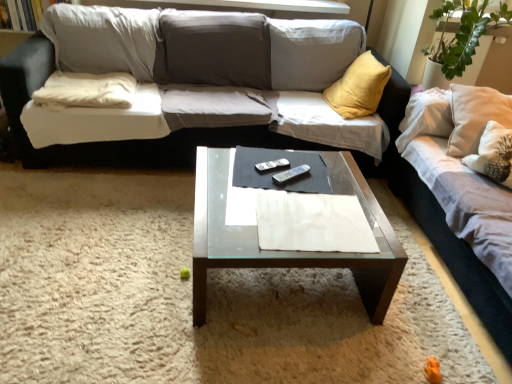
Where is `vacant space in front of black plastic remote at center, which is the second remote from top to bottom`? The image size is (512, 384). vacant space in front of black plastic remote at center, which is the second remote from top to bottom is located at coordinates (295, 196).